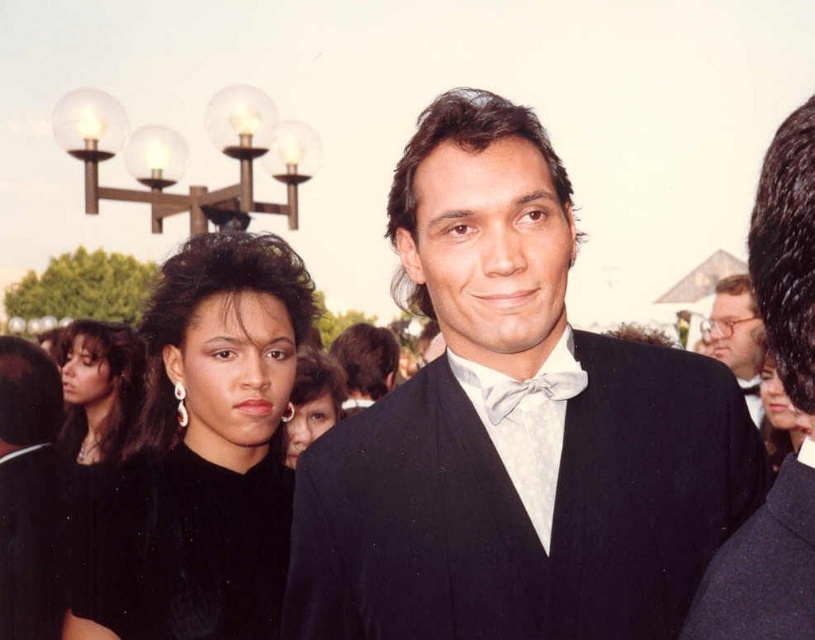
You are organizing a photo shoot and need to arrange two outfits in a small studio. The navy wool business suit at right and the black satin dress at center are the main items. Given the space constraints, which outfit takes up more space when displayed?

The black satin dress at center takes up more space than the navy wool business suit at right, so it would require more room in the studio.

You are standing at the camera position and want to place a small decoration at the point marked as point [752,624]. If the decoration requires a minimum distance of 2 meters from the camera to be visible clearly, will it be visible?

The distance of point [752,624] from the camera is 1.92 meters, which is less than the required 2 meters. Therefore, the decoration placed at point [752,624] will not be visible clearly.

You are a photographer at a red carpet event who needs to capture a group photo of the black matte dress at left and the shiny black suit at center. Your camera has a maximum focus range of 10 feet. Will you be able to include both subjects in the same frame without moving closer?

The distance between the black matte dress at left and the shiny black suit at center is 9.54 feet, which is within the camera maximum focus range of 10 feet. Yes, you can capture both subjects in the same frame without moving closer.